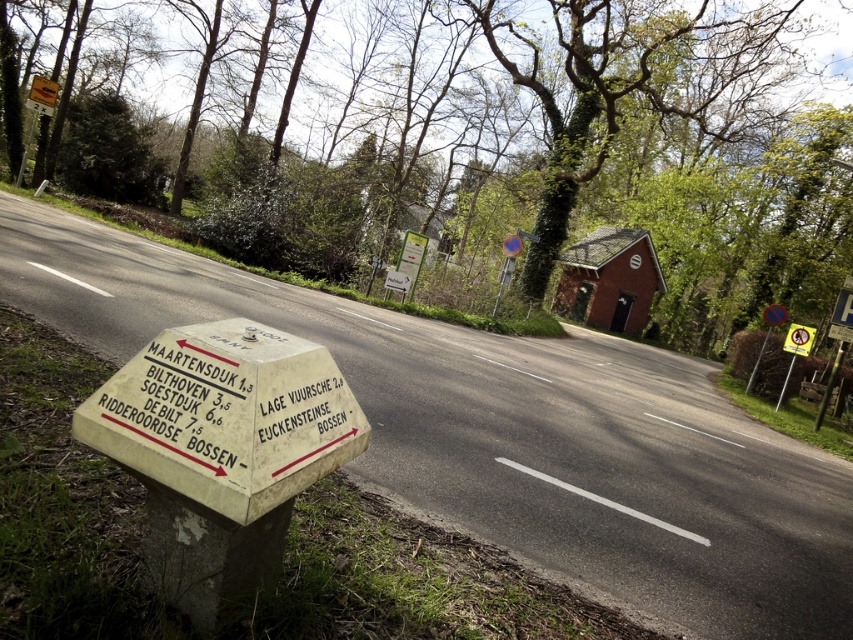
You are standing at the signpost and want to take a photo that includes both the point at coordinates point (x=200, y=332) and point (x=759, y=352). To ensure both points are in the frame, should you zoom in or zoom out?

Since point (x=200, y=332) is closer to the viewer than point (x=759, y=352), you should zoom out to include both points in the frame.

You are a delivery driver who needs to navigate using the signpost in the scene. You see a point marked at coordinates (225, 416). What object is located at that point?

The point at coordinates (225, 416) corresponds to the white plastic signpost at lower left.